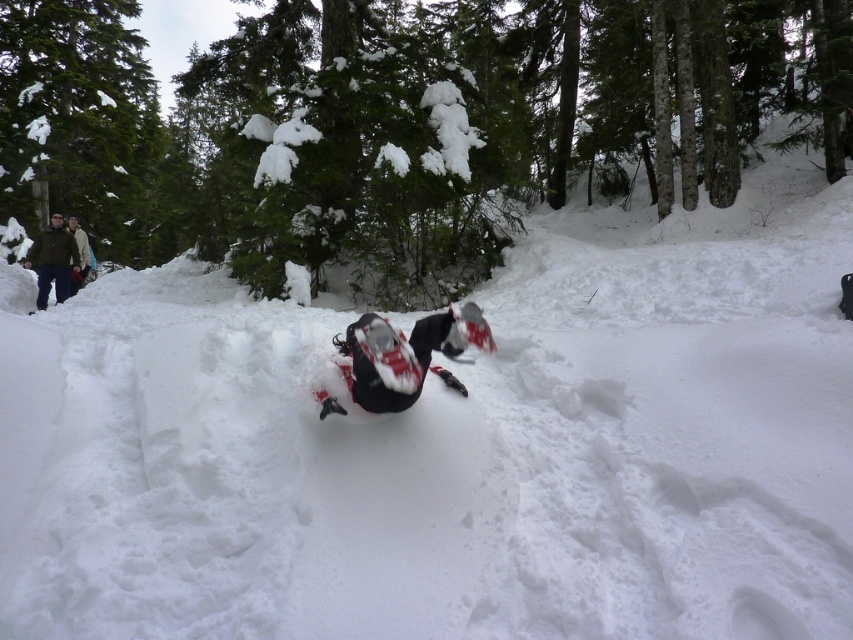
Can you confirm if green matte jacket at left is thinner than tan wool jacket at upper left?

Yes, green matte jacket at left is thinner than tan wool jacket at upper left.

Does point (49, 248) come in front of point (74, 284)?

Yes, point (49, 248) is in front of point (74, 284).

Identify the location of green matte jacket at left. The height and width of the screenshot is (640, 853). (53, 259).

Which is behind, point (395, 394) or point (55, 285)?

The point (55, 285) is behind.

Can you confirm if red matte snowmobile at center is positioned above green matte jacket at left?

Incorrect, red matte snowmobile at center is not positioned above green matte jacket at left.

Does point (440, 333) lie behind point (47, 278)?

No, (440, 333) is in front of (47, 278).

At what (x,y) coordinates should I click in order to perform the action: click on red matte snowmobile at center. Please return your answer as a coordinate pair (x, y). The image size is (853, 640). Looking at the image, I should click on pos(405,355).

Between red matte snowmobile at center and tan wool jacket at upper left, which one is positioned lower?

red matte snowmobile at center is below.

Which is in front, point (323, 396) or point (70, 294)?

Point (323, 396) is more forward.

This screenshot has height=640, width=853. What are the coordinates of `red matte snowmobile at center` in the screenshot? It's located at (405, 355).